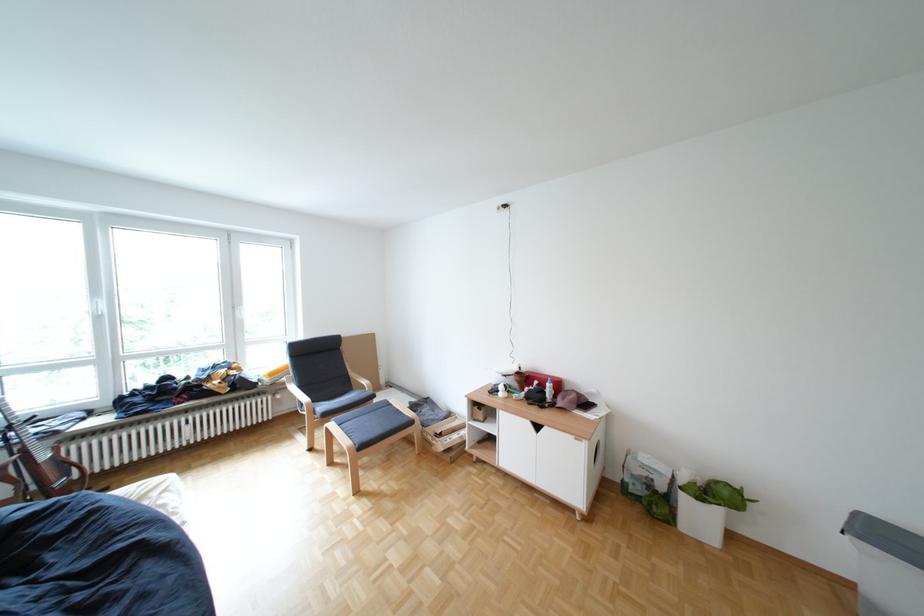
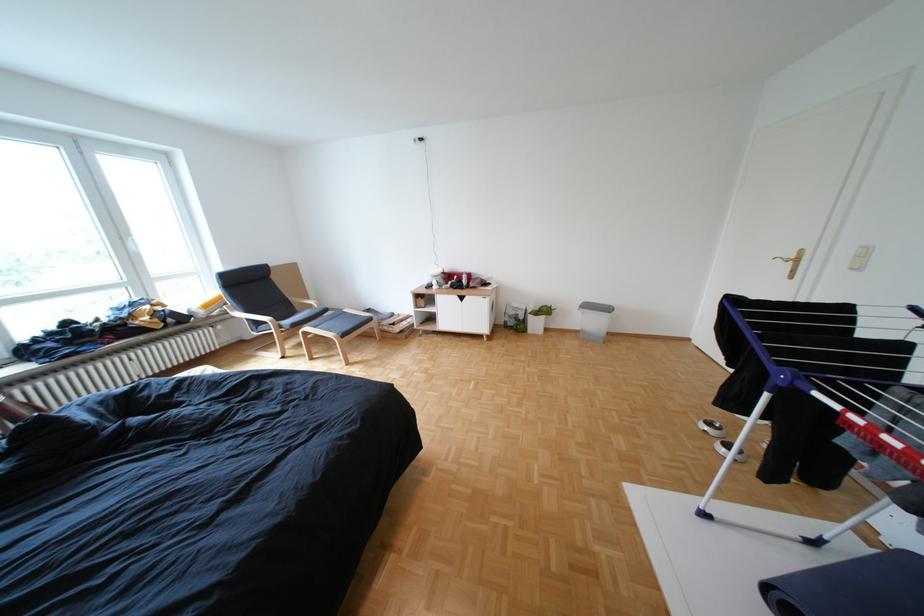
Find the pixel in the second image that matches pixel 338 408 in the first image.

(301, 323)